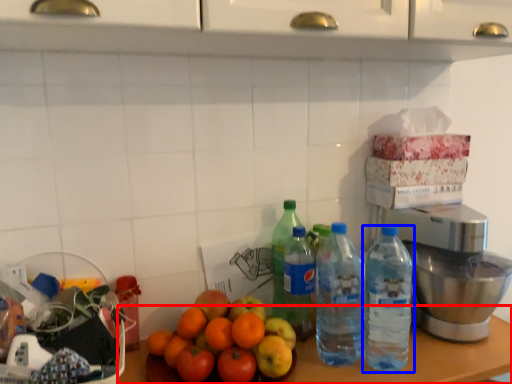
Question: Which of the following is the closest to the observer, table (highlighted by a red box) or bottle (highlighted by a blue box)?

Choices:
 (A) table
 (B) bottle

Answer: (A)